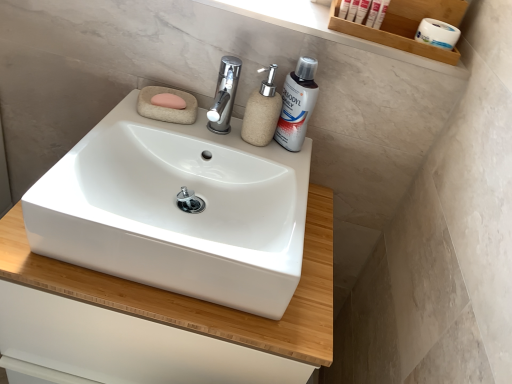
Identify the location of free space to the left of white plastic toothpaste at upper right, marked as the 2th personal care in a left-to-right arrangement. The height and width of the screenshot is (384, 512). (300, 14).